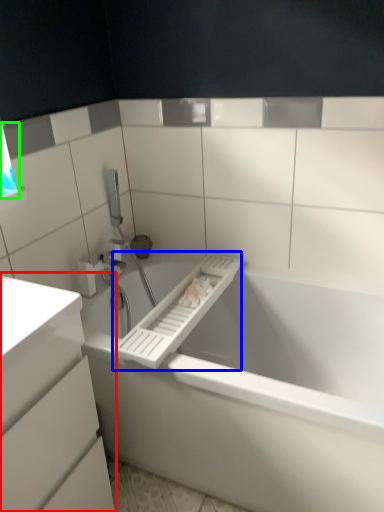
Question: Based on their relative distances, which object is nearer to bathroom cabinet (highlighted by a red box)? Choose from towel bar (highlighted by a blue box) and window (highlighted by a green box).

Choices:
 (A) towel bar
 (B) window

Answer: (A)